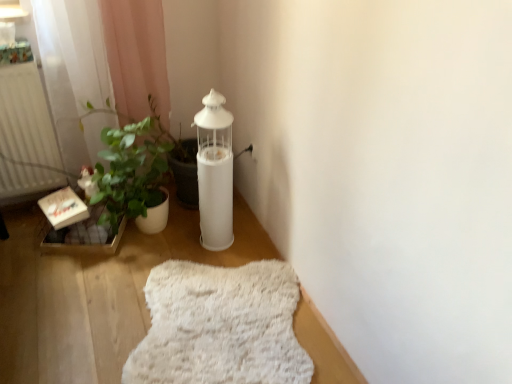
Question: Considering the relative sizes of white matte radiator at left and white fluffy rug at lower center in the image provided, is white matte radiator at left shorter than white fluffy rug at lower center?

Choices:
 (A) no
 (B) yes

Answer: (A)

Question: From a real-world perspective, is white matte radiator at left physically below white fluffy rug at lower center?

Choices:
 (A) no
 (B) yes

Answer: (A)

Question: Is white matte radiator at left behind white fluffy rug at lower center?

Choices:
 (A) yes
 (B) no

Answer: (A)

Question: Considering the relative sizes of white matte radiator at left and white fluffy rug at lower center in the image provided, is white matte radiator at left wider than white fluffy rug at lower center?

Choices:
 (A) yes
 (B) no

Answer: (B)

Question: Is white matte radiator at left not close to white fluffy rug at lower center?

Choices:
 (A) yes
 (B) no

Answer: (B)

Question: Is white matte radiator at left smaller than white fluffy rug at lower center?

Choices:
 (A) no
 (B) yes

Answer: (A)

Question: Is white matte radiator at left at the left side of white matte oil lamp at center?

Choices:
 (A) no
 (B) yes

Answer: (B)

Question: Does white matte radiator at left come behind white matte oil lamp at center?

Choices:
 (A) no
 (B) yes

Answer: (B)

Question: From a real-world perspective, is white matte radiator at left located beneath white matte oil lamp at center?

Choices:
 (A) no
 (B) yes

Answer: (A)

Question: Considering the relative sizes of white matte radiator at left and white matte oil lamp at center in the image provided, is white matte radiator at left shorter than white matte oil lamp at center?

Choices:
 (A) no
 (B) yes

Answer: (B)

Question: Is white matte radiator at left wider than white matte oil lamp at center?

Choices:
 (A) yes
 (B) no

Answer: (B)

Question: Can you confirm if white matte radiator at left is taller than white matte oil lamp at center?

Choices:
 (A) yes
 (B) no

Answer: (B)

Question: From a real-world perspective, is white fluffy rug at lower center under white matte radiator at left?

Choices:
 (A) yes
 (B) no

Answer: (A)